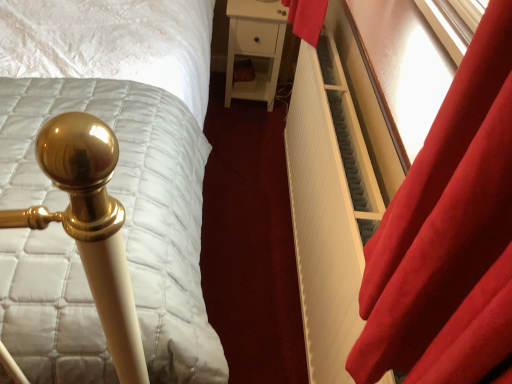
Find the location of `gold metallic bedpost at left`. gold metallic bedpost at left is located at coordinates (125, 146).

What do you see at coordinates (328, 207) in the screenshot?
I see `white ribbed radiator at right` at bounding box center [328, 207].

Locate an element on the screen. This screenshot has height=384, width=512. white matte nightstand at center is located at coordinates (255, 46).

Describe the element at coordinates (255, 46) in the screenshot. Image resolution: width=512 pixels, height=384 pixels. I see `white matte nightstand at center` at that location.

Locate an element on the screen. Image resolution: width=512 pixels, height=384 pixels. gold metallic bedpost at left is located at coordinates (125, 146).

Which of these two, velvet red curtain at right or white matte nightstand at center, is bigger?

white matte nightstand at center.

Is velvet red curtain at right spatially inside white matte nightstand at center, or outside of it?

velvet red curtain at right is not enclosed by white matte nightstand at center.

Which object is positioned more to the right, velvet red curtain at right or white matte nightstand at center?

Result: velvet red curtain at right is more to the right.

Is velvet red curtain at right looking in the opposite direction of white matte nightstand at center?

No.

Does gold metallic bedpost at left come in front of white ribbed radiator at right?

No, the depth of gold metallic bedpost at left is greater than that of white ribbed radiator at right.

Considering the sizes of objects gold metallic bedpost at left and white ribbed radiator at right in the image provided, who is bigger, gold metallic bedpost at left or white ribbed radiator at right?

Bigger between the two is gold metallic bedpost at left.

From the picture: Between gold metallic bedpost at left and white ribbed radiator at right, which one has smaller width?

Thinner between the two is white ribbed radiator at right.

Is white ribbed radiator at right at the back of gold metallic bedpost at left?

gold metallic bedpost at left does not have its back to white ribbed radiator at right.

Is white matte nightstand at center far from white ribbed radiator at right?

No, white matte nightstand at center is not far from white ribbed radiator at right.

Which is more to the right, white matte nightstand at center or white ribbed radiator at right?

white ribbed radiator at right is more to the right.

In the image, is white matte nightstand at center positioned in front of or behind white ribbed radiator at right?

In the image, white matte nightstand at center appears behind white ribbed radiator at right.

Does white matte nightstand at center have a greater height compared to white ribbed radiator at right?

Incorrect, the height of white matte nightstand at center is not larger of that of white ribbed radiator at right.

From a real-world perspective, which object rests below the other?

white matte nightstand at center is physically lower.

Which object is positioned more to the right, white ribbed radiator at right or white matte nightstand at center?

white ribbed radiator at right is more to the right.

Is white ribbed radiator at right positioned with its back to white matte nightstand at center?

That's not correct — white ribbed radiator at right is not looking away from white matte nightstand at center.

How different are the orientations of velvet red curtain at right and gold metallic bedpost at left in degrees?

0.97 degrees separate the facing orientations of velvet red curtain at right and gold metallic bedpost at left.

Is point (459, 330) less distant than point (135, 84)?

Yes, it is in front of point (135, 84).

Looking at this image, can you see velvet red curtain at right touching gold metallic bedpost at left?

velvet red curtain at right is not next to gold metallic bedpost at left, and they're not touching.

From a real-world perspective, is gold metallic bedpost at left physically located above or below velvet red curtain at right?

gold metallic bedpost at left is situated lower than velvet red curtain at right in the real world.

From the image's perspective, is gold metallic bedpost at left located beneath velvet red curtain at right?

Yes, from the image's perspective, gold metallic bedpost at left is beneath velvet red curtain at right.

Can you confirm if gold metallic bedpost at left is taller than velvet red curtain at right?

Yes.

Is velvet red curtain at right at the back of gold metallic bedpost at left?

That's not correct — gold metallic bedpost at left is not looking away from velvet red curtain at right.

From a real-world perspective, between white ribbed radiator at right and gold metallic bedpost at left, who is vertically lower?

gold metallic bedpost at left, from a real-world perspective.

Who is bigger, white ribbed radiator at right or gold metallic bedpost at left?

gold metallic bedpost at left is bigger.

Is white ribbed radiator at right looking in the opposite direction of gold metallic bedpost at left?

That's not correct — white ribbed radiator at right is not looking away from gold metallic bedpost at left.

Is white ribbed radiator at right touching gold metallic bedpost at left?

No, white ribbed radiator at right is not making contact with gold metallic bedpost at left.

Locate an element on the screen. The image size is (512, 384). furniture above the velvet red curtain at right (from the image's perspective) is located at coordinates (255, 46).

I want to click on radiator that is above the gold metallic bedpost at left (from a real-world perspective), so click(328, 207).

From the image, which object appears to be farther from white ribbed radiator at right, velvet red curtain at right or white matte nightstand at center?

white matte nightstand at center is further to white ribbed radiator at right.

Looking at the image, which one is located closer to white ribbed radiator at right, white matte nightstand at center or gold metallic bedpost at left?

Among the two, gold metallic bedpost at left is located nearer to white ribbed radiator at right.

Looking at the image, which one is located further to white ribbed radiator at right, gold metallic bedpost at left or velvet red curtain at right?

gold metallic bedpost at left is positioned further to the anchor white ribbed radiator at right.

Looking at the image, which one is located further to velvet red curtain at right, white matte nightstand at center or white ribbed radiator at right?

Among the two, white matte nightstand at center is located further to velvet red curtain at right.

Based on their spatial positions, is velvet red curtain at right or white ribbed radiator at right further from gold metallic bedpost at left?

Based on the image, velvet red curtain at right appears to be further to gold metallic bedpost at left.

Estimate the real-world distances between objects in this image. Which object is further from white ribbed radiator at right, white matte nightstand at center or velvet red curtain at right?

white matte nightstand at center is positioned further to the anchor white ribbed radiator at right.

Estimate the real-world distances between objects in this image. Which object is closer to white matte nightstand at center, velvet red curtain at right or white ribbed radiator at right?

Based on the image, white ribbed radiator at right appears to be nearer to white matte nightstand at center.

Consider the image. Estimate the real-world distances between objects in this image. Which object is closer to white ribbed radiator at right, gold metallic bedpost at left or white matte nightstand at center?

gold metallic bedpost at left.

Where is `bed between velvet red curtain at right and white matte nightstand at center in the front-back direction`? The height and width of the screenshot is (384, 512). bed between velvet red curtain at right and white matte nightstand at center in the front-back direction is located at coordinates (125, 146).

Identify the location of radiator between velvet red curtain at right and white matte nightstand at center from front to back. (328, 207).

Find the location of `radiator between gold metallic bedpost at left and velvet red curtain at right in the horizontal direction`. radiator between gold metallic bedpost at left and velvet red curtain at right in the horizontal direction is located at coordinates (328, 207).

Identify the location of bed positioned between white ribbed radiator at right and white matte nightstand at center from near to far. (125, 146).